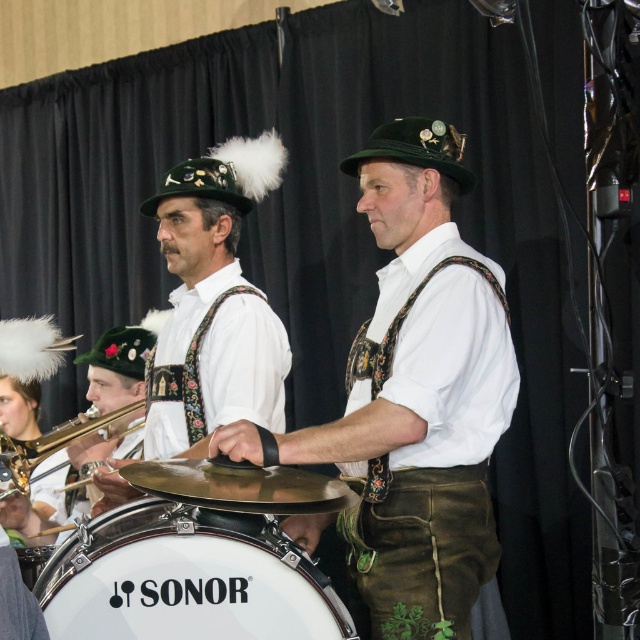
You are a photographer positioned at the point marked by coordinates (186, 579) in the image. Based on the scene description, what object are you standing at?

The point marked by coordinates (186, 579) is at the white matte drum at center.

You are a photographer at the event and want to capture a closeup of the drummer. Given that the green leather pants at center and the white matte drum at center are in the frame, which object should you focus on to ensure the drummer is clearly visible?

The green leather pants at center is larger in size than the white matte drum at center, so focusing on the green leather pants at center will ensure the drummer is clearly visible as it takes up more space in the frame.